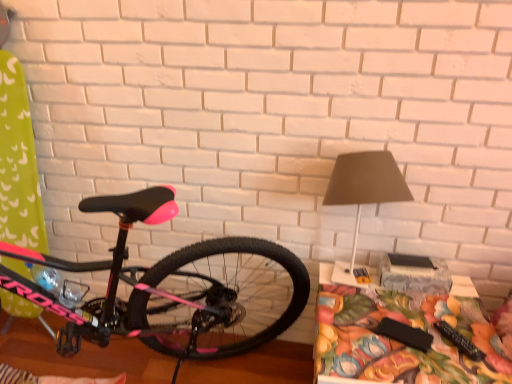
At what (x,y) coordinates should I click in order to perform the action: click on vacant space underneath matte gray lampshade at upper right (from a real-world perspective). Please return your answer as a coordinate pair (x, y). The image size is (512, 384). Looking at the image, I should click on (355, 290).